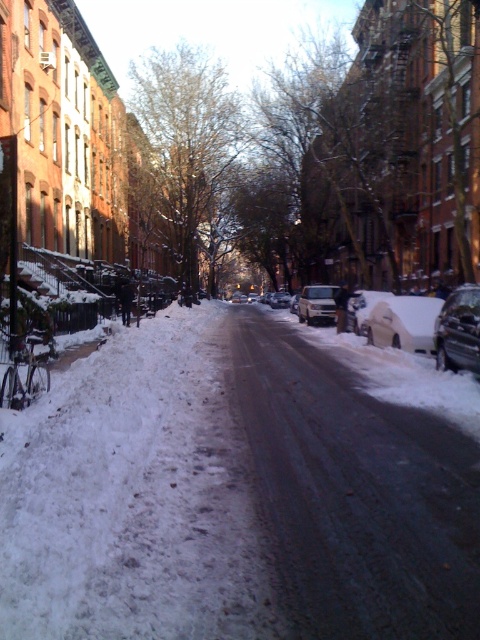
Based on the photo, you are a delivery person needing to cross the street from the shiny black car at right to the bicycle parked on the left side. The street is 10.60 meters wide. Your delivery requires you to carry a package that limits your walking distance to 10 meters. Can you safely make this crossing without exceeding your walking limit?

The distance between the shiny black car at right and the bicycle parked on the left side is 10.60 meters. Since your walking limit is 10 meters, you cannot safely cross the street without exceeding your walking limit.

You are a delivery person trying to park your small motorcycle between the white matte car at right and the silver metallic van at center. According to the scene, can you fit your motorcycle there?

Answer: The white matte car at right is to the left of the silver metallic van at center, meaning there is space between them. Since your motorcycle is small, you should be able to fit it between the two vehicles.